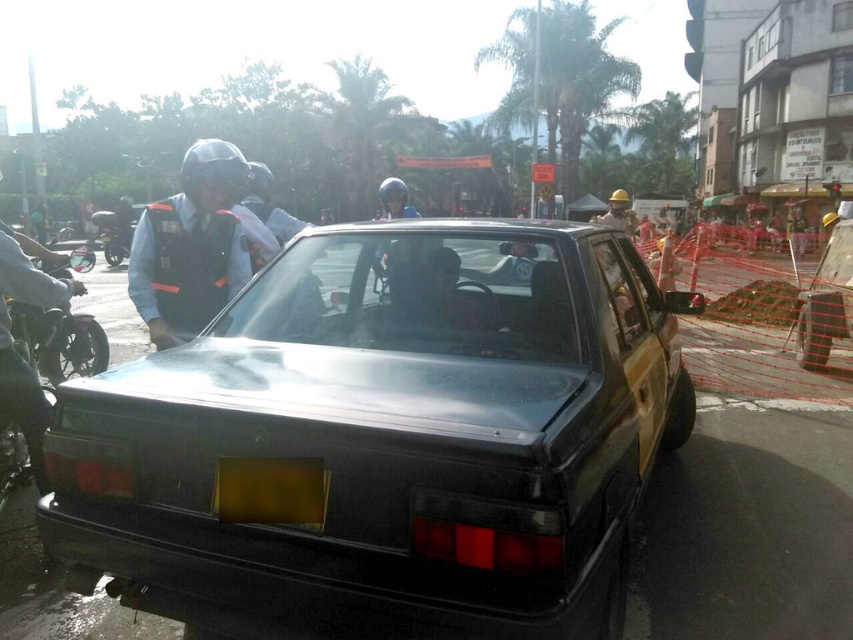
Question: Which object is farther from the camera taking this photo?

Choices:
 (A) metallic silver car at center
 (B) hard hat at center
 (C) matte black helmet at upper left
 (D) black matte car at center

Answer: (B)

Question: Is matte black helmet at upper left bigger than matte black helmet at left?

Choices:
 (A) yes
 (B) no

Answer: (B)

Question: Is matte black helmet at left positioned before hard hat at center?

Choices:
 (A) yes
 (B) no

Answer: (A)

Question: Can you confirm if black matte car at center is bigger than matte black helmet at upper left?

Choices:
 (A) yes
 (B) no

Answer: (A)

Question: Which object is closer to the camera taking this photo?

Choices:
 (A) matte black helmet at upper left
 (B) metallic silver car at center
 (C) black matte car at center

Answer: (C)

Question: Which is farther from the matte black helmet at upper left?

Choices:
 (A) black matte car at center
 (B) yellow matte license plate at center
 (C) hard hat at center

Answer: (C)